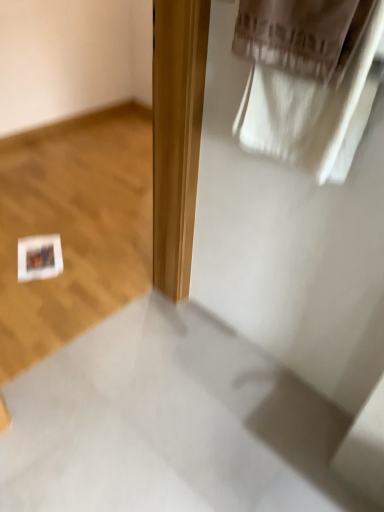
Where is `white textured curtain at upper right`? white textured curtain at upper right is located at coordinates (311, 112).

The image size is (384, 512). What do you see at coordinates (311, 112) in the screenshot? I see `white textured curtain at upper right` at bounding box center [311, 112].

The width and height of the screenshot is (384, 512). I want to click on white textured curtain at upper right, so click(311, 112).